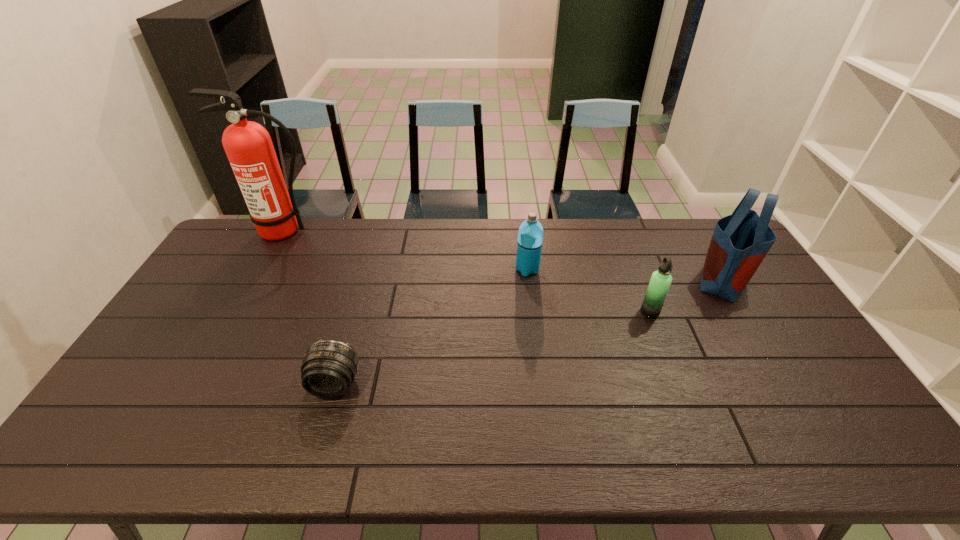
Where is `object that is at the far right corner`? This screenshot has height=540, width=960. object that is at the far right corner is located at coordinates (740, 242).

This screenshot has width=960, height=540. In the image, there is a desktop. Find the location of `free space at the far edge`. free space at the far edge is located at coordinates (588, 247).

At what (x,y) coordinates should I click in order to perform the action: click on vacant space at the near edge of the desktop. Please return your answer as a coordinate pair (x, y). This screenshot has height=540, width=960. Looking at the image, I should click on (287, 457).

In the image, there is a desktop. Find the location of `vacant space at the left edge`. vacant space at the left edge is located at coordinates (222, 289).

The width and height of the screenshot is (960, 540). I want to click on vacant space at the far right corner of the desktop, so click(714, 226).

You are a GUI agent. You are given a task and a screenshot of the screen. Output one action in this format:
    pyautogui.click(x=<x>, y=<y>)
    Task: Click on the free space between the fire extinguisher and the farther thermos bottle
    Image resolution: width=960 pixels, height=540 pixels.
    Given the screenshot: What is the action you would take?
    pyautogui.click(x=406, y=251)

Where is `free point between the tallest object and the farther thermos bottle`? This screenshot has width=960, height=540. free point between the tallest object and the farther thermos bottle is located at coordinates (406, 251).

The image size is (960, 540). Find the location of `free area in between the right thermos bottle and the farthest object`. free area in between the right thermos bottle and the farthest object is located at coordinates (468, 272).

Where is `free spot between the second tallest object and the farther thermos bottle`? free spot between the second tallest object and the farther thermos bottle is located at coordinates (625, 274).

Where is `free space between the handbag and the nearer thermos bottle`? The height and width of the screenshot is (540, 960). free space between the handbag and the nearer thermos bottle is located at coordinates (686, 295).